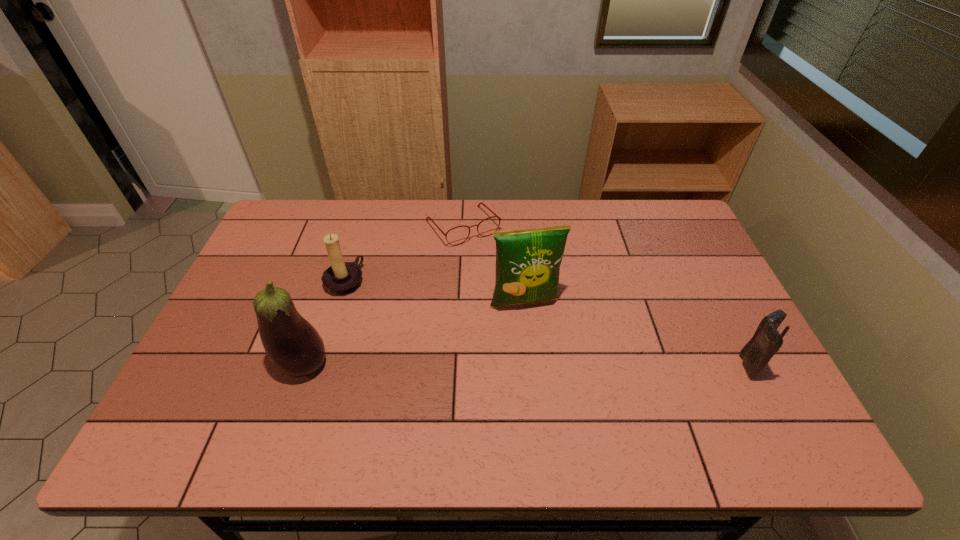
I want to click on eggplant, so click(x=293, y=345).

You are a GUI agent. You are given a task and a screenshot of the screen. Output one action in this format:
    pyautogui.click(x=<x>, y=<y>)
    Task: Click on the rightmost object
    
    Given the screenshot: What is the action you would take?
    pyautogui.click(x=766, y=341)

I want to click on candle holder, so click(342, 278).

Locate an element on the screen. the shortest object is located at coordinates (478, 205).

This screenshot has width=960, height=540. Find the location of `the farthest object`. the farthest object is located at coordinates (478, 205).

At what (x,y) coordinates should I click in order to perform the action: click on crisp (potato chip). Please return your answer as a coordinate pair (x, y). This screenshot has height=540, width=960. Looking at the image, I should click on (528, 261).

This screenshot has height=540, width=960. In order to click on vacant region located on the right of the eggplant in this screenshot , I will do `click(424, 364)`.

Where is `free space located on the wick of the candle holder`? The width and height of the screenshot is (960, 540). free space located on the wick of the candle holder is located at coordinates (469, 343).

Locate an element on the screen. free location located 0.300m on the wick of the candle holder is located at coordinates (444, 331).

I want to click on free point located on the wick of the candle holder, so pos(375,298).